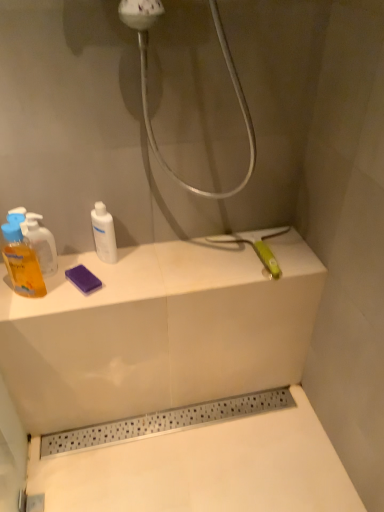
Locate an element on the screen. spots to the right of translucent orange liquid at left, acting as the second mouthwash starting from the left is located at coordinates (102, 275).